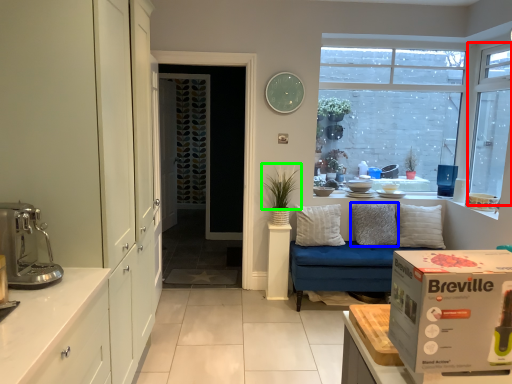
Question: Which object is the closest to the window (highlighted by a red box)? Choose among these: pillow (highlighted by a blue box) or plant (highlighted by a green box).

Choices:
 (A) pillow
 (B) plant

Answer: (A)